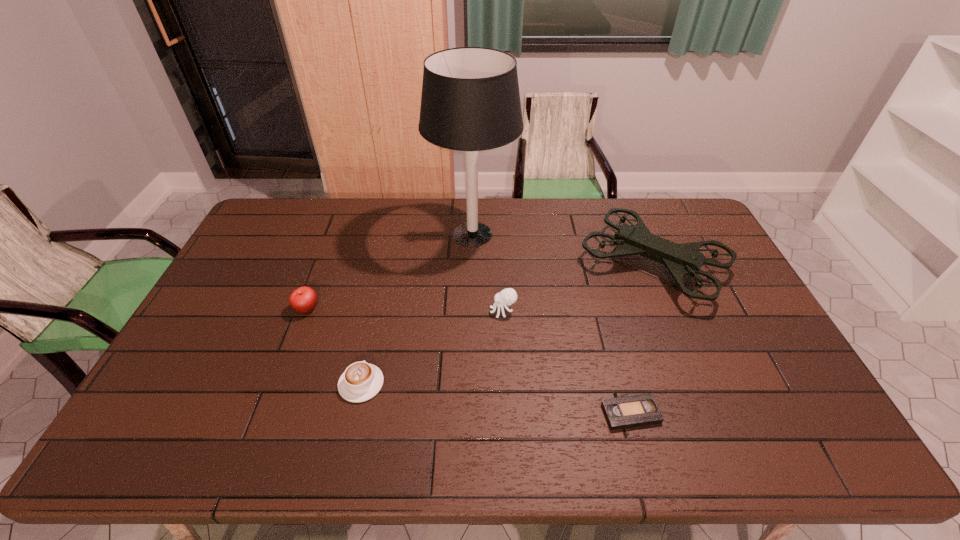
Identify the location of table lamp. The width and height of the screenshot is (960, 540). (470, 101).

The width and height of the screenshot is (960, 540). Identify the location of drone. (684, 259).

Image resolution: width=960 pixels, height=540 pixels. Identify the location of octopus. (508, 296).

Image resolution: width=960 pixels, height=540 pixels. Identify the location of apple. 304,299.

The image size is (960, 540). Identify the location of the fifth tallest object. (361, 381).

The image size is (960, 540). Find the location of `the second object from left to right`. the second object from left to right is located at coordinates (361, 381).

This screenshot has width=960, height=540. I want to click on the shortest object, so click(x=638, y=410).

You are a GUI agent. You are given a task and a screenshot of the screen. Output one action in this format:
    pyautogui.click(x=<x>, y=<y>)
    Task: Click on the vacant space located 0.060m on the left of the tallest object
    The height and width of the screenshot is (540, 960).
    Given the screenshot: What is the action you would take?
    pyautogui.click(x=413, y=234)

Locate an element on the screen. This screenshot has width=960, height=540. free space located on the front of the drone is located at coordinates (714, 413).

Locate an element on the screen. The width and height of the screenshot is (960, 540). vacant region located 0.320m on the front-facing side of the octopus is located at coordinates (384, 311).